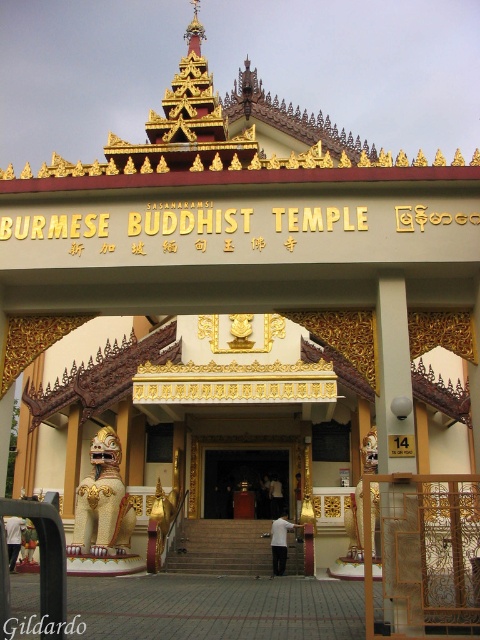
You are a visitor at the Burmese Buddhist Temple entrance and want to enter through the entrance. The door has a sign above it. Which object is taller, the polished wood door at center or the blacktexturedwriting at center?

The polished wood door at center is much taller as blacktexturedwriting at center, so the door is taller than the blacktexturedwriting.

You are standing at the entrance of the Burmese Buddhist Temple and want to locate the polished wood door at center. According to the coordinates provided, where exactly is the door positioned relative to the archway?

The polished wood door at center is positioned at coordinates point (244,481) relative to the archway.